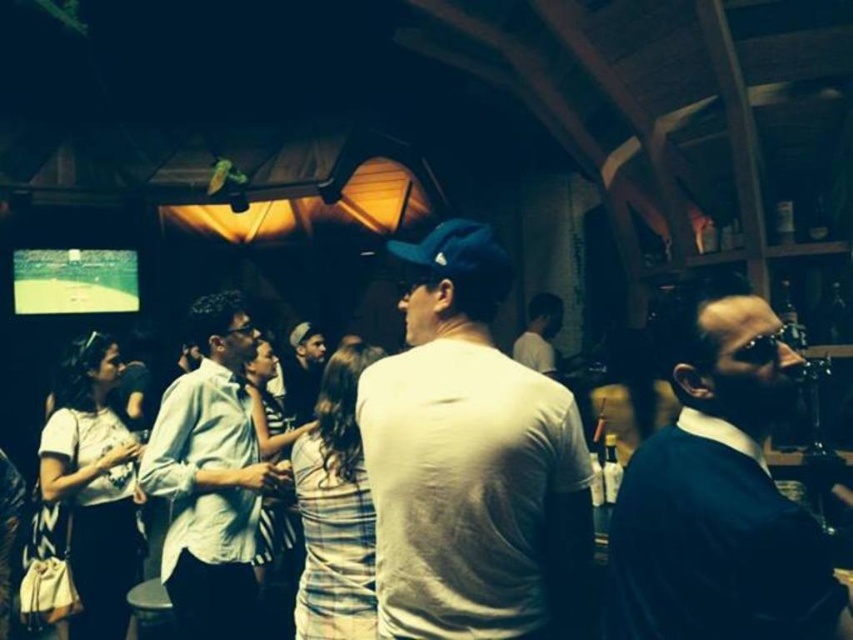
Question: Can you confirm if dark blue sweater at right is thinner than white matte shirt at center?

Choices:
 (A) no
 (B) yes

Answer: (A)

Question: Which is nearer to the white matte shirt at center?

Choices:
 (A) dark gray knit cap at center
 (B) dark blue sweater at right

Answer: (A)

Question: Considering the relative positions of white matte t-shirt at center and light blue striped shirt at center in the image provided, where is white matte t-shirt at center located with respect to light blue striped shirt at center?

Choices:
 (A) left
 (B) right

Answer: (B)

Question: Can you confirm if dark gray knit cap at center is wider than white matte shirt at center?

Choices:
 (A) yes
 (B) no

Answer: (A)

Question: Which of the following is the farthest from the observer?

Choices:
 (A) (311, 403)
 (B) (694, 468)
 (C) (212, 545)

Answer: (A)

Question: Which object appears closest to the camera in this image?

Choices:
 (A) dark gray knit cap at center
 (B) white matte t-shirt at center

Answer: (B)